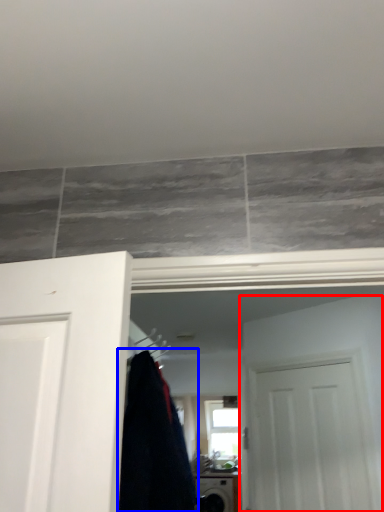
Question: Among these objects, which one is farthest to the camera, door (highlighted by a red box) or clothing (highlighted by a blue box)?

Choices:
 (A) door
 (B) clothing

Answer: (A)